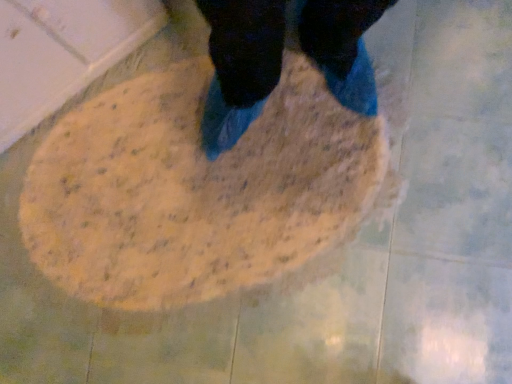
This screenshot has height=384, width=512. Find the location of `space that is in front of beige textured rug at center`. space that is in front of beige textured rug at center is located at coordinates (350, 318).